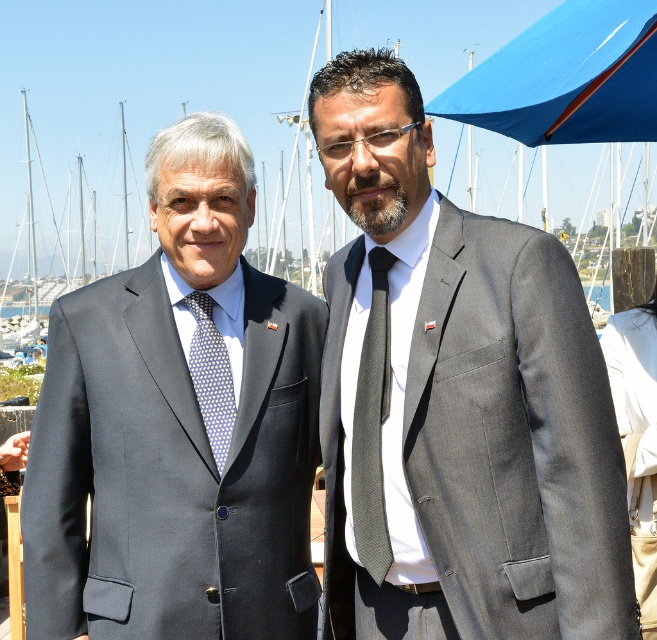
Question: Which point appears farthest from the camera in this image?

Choices:
 (A) (39, 508)
 (B) (204, 340)

Answer: (B)

Question: Which is farther from the matte gray suit at center?

Choices:
 (A) matte black suit at center
 (B) dark gray textured tie at center

Answer: (A)

Question: Is matte gray suit at center above dark gray textured tie at center?

Choices:
 (A) no
 (B) yes

Answer: (A)

Question: Which object appears farthest from the camera in this image?

Choices:
 (A) blue dotted tie at left
 (B) dark gray textured tie at center

Answer: (A)

Question: Is matte gray suit at center wider than blue dotted tie at left?

Choices:
 (A) no
 (B) yes

Answer: (B)

Question: In this image, where is matte gray suit at center located relative to blue dotted tie at left?

Choices:
 (A) left
 (B) right

Answer: (B)